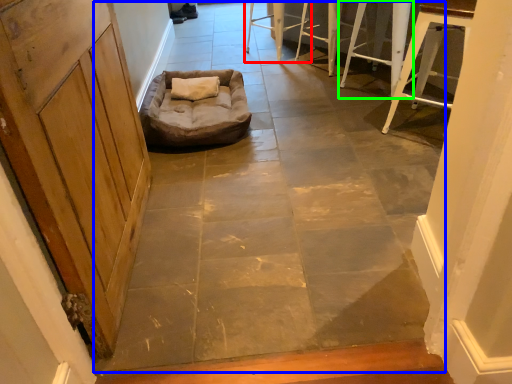
Question: Which object is positioned farthest from furniture (highlighted by a red box)? Select from concrete (highlighted by a blue box) and furniture (highlighted by a green box).

Choices:
 (A) concrete
 (B) furniture

Answer: (A)